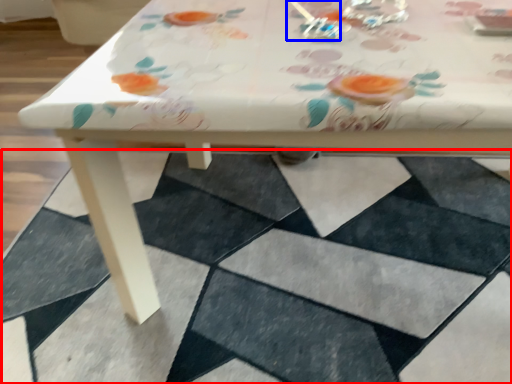
Question: Among these objects, which one is farthest to the camera, square (highlighted by a red box) or tableware (highlighted by a blue box)?

Choices:
 (A) square
 (B) tableware

Answer: (B)